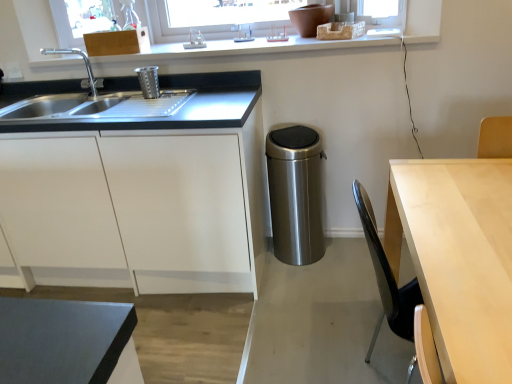
Find the location of a particular element. This screenshot has height=384, width=512. vacant space in front of stainless steel trash can at center, arranged as the first appliance when ordered from the bottom is located at coordinates [x=306, y=284].